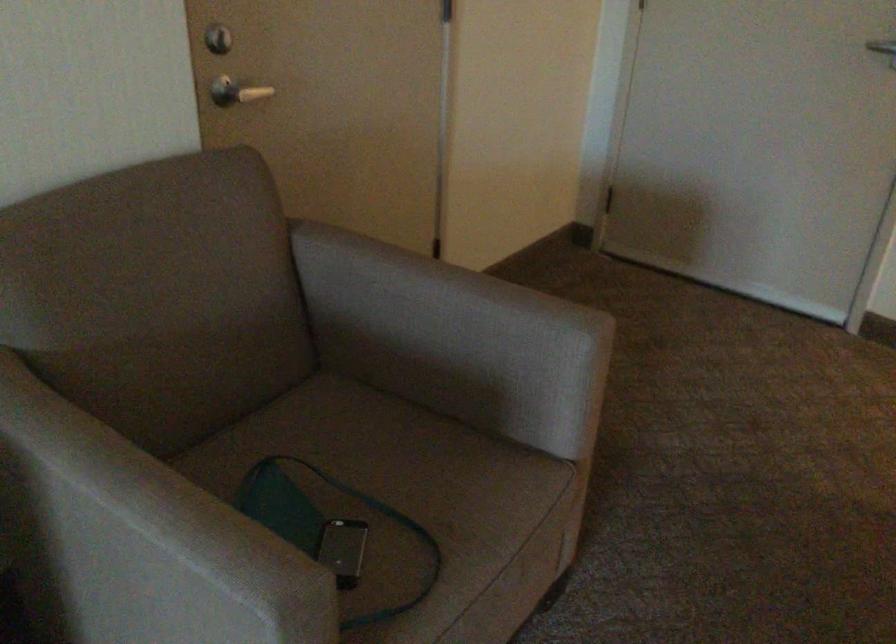
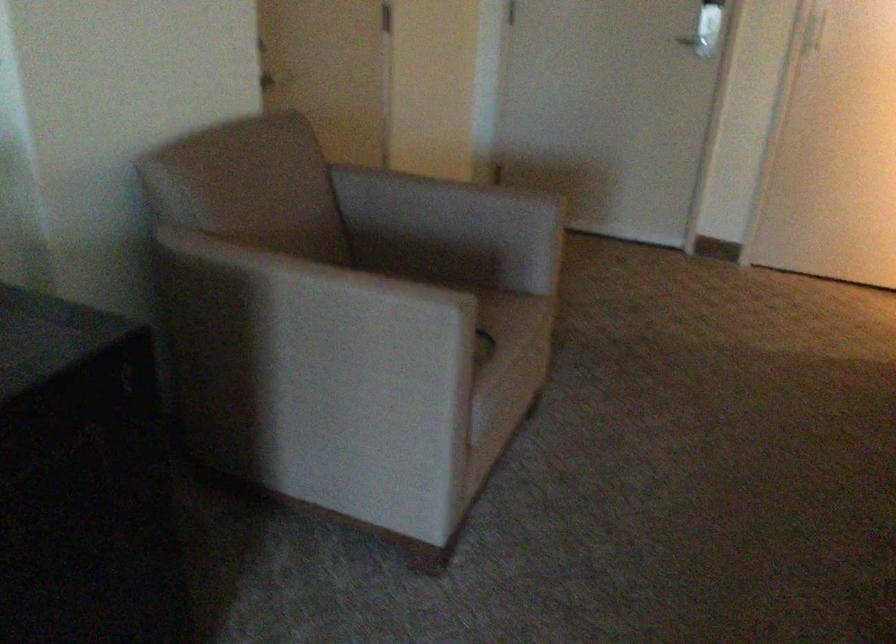
Where in the second image is the point corresponding to (108,554) from the first image?

(314, 325)